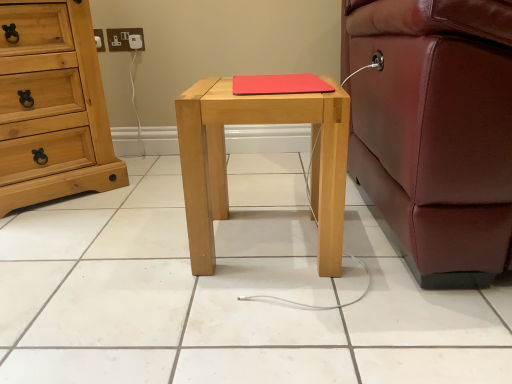
Measure the distance between light brown wooden chest of drawers at left and camera.

3.83 feet.

Find the location of a particular element. This screenshot has width=512, height=384. light brown wooden chest of drawers at left is located at coordinates (53, 108).

You are a GUI agent. You are given a task and a screenshot of the screen. Output one action in this format:
    pyautogui.click(x=<x>, y=<y>)
    Task: Click on the white plastic socket at upper left
    The image size is (512, 384).
    Given the screenshot: What is the action you would take?
    pyautogui.click(x=125, y=39)

Identify the location of light wood/texture nightstand at center. The image size is (512, 384). pos(226,168).

Can you confirm if light wood/texture nightstand at center is thinner than white plastic socket at upper left?

In fact, light wood/texture nightstand at center might be wider than white plastic socket at upper left.

From the image's perspective, is light wood/texture nightstand at center beneath white plastic socket at upper left?

Yes, from the image's perspective, light wood/texture nightstand at center is below white plastic socket at upper left.

Is light wood/texture nightstand at center taller than white plastic socket at upper left?

Indeed, light wood/texture nightstand at center has a greater height compared to white plastic socket at upper left.

Considering the relative sizes of red matte mousepad at center and light wood/texture nightstand at center in the image provided, is red matte mousepad at center taller than light wood/texture nightstand at center?

In fact, red matte mousepad at center may be shorter than light wood/texture nightstand at center.

Is red matte mousepad at center bigger than light wood/texture nightstand at center?

Actually, red matte mousepad at center might be smaller than light wood/texture nightstand at center.

Between red matte mousepad at center and light wood/texture nightstand at center, which one is positioned behind?

Positioned behind is red matte mousepad at center.

Where is `nightstand that appears in front of the red matte mousepad at center`? The image size is (512, 384). nightstand that appears in front of the red matte mousepad at center is located at coordinates (226, 168).

Which of these two, light brown wooden chest of drawers at left or white plastic socket at upper left, is smaller?

white plastic socket at upper left is smaller.

From a real-world perspective, which is physically above, light brown wooden chest of drawers at left or white plastic socket at upper left?

white plastic socket at upper left is physically above.

From the image's perspective, which object appears higher, light brown wooden chest of drawers at left or white plastic socket at upper left?

white plastic socket at upper left is shown above in the image.

Where is `pad below the white plastic socket at upper left (from a real-world perspective)`? Image resolution: width=512 pixels, height=384 pixels. pad below the white plastic socket at upper left (from a real-world perspective) is located at coordinates (279, 84).

Does red matte mousepad at center appear on the left side of white plastic socket at upper left?

No.

Looking at their sizes, would you say red matte mousepad at center is wider or thinner than white plastic socket at upper left?

red matte mousepad at center is wider than white plastic socket at upper left.

Looking at this image, can you confirm if red matte mousepad at center is taller than white plastic socket at upper left?

Incorrect, the height of red matte mousepad at center is not larger of that of white plastic socket at upper left.

Considering the sizes of light wood/texture nightstand at center and light brown wooden chest of drawers at left in the image, is light wood/texture nightstand at center wider or thinner than light brown wooden chest of drawers at left?

light wood/texture nightstand at center is thinner than light brown wooden chest of drawers at left.

Is the depth of light wood/texture nightstand at center greater than that of light brown wooden chest of drawers at left?

No, light wood/texture nightstand at center is closer to the viewer.

Based on their sizes in the image, would you say light wood/texture nightstand at center is bigger or smaller than light brown wooden chest of drawers at left?

light wood/texture nightstand at center is smaller than light brown wooden chest of drawers at left.

Does light wood/texture nightstand at center appear on the left side of light brown wooden chest of drawers at left?

In fact, light wood/texture nightstand at center is to the right of light brown wooden chest of drawers at left.

Between point (337, 234) and point (287, 74), which one is positioned in front?

The point (337, 234) is closer.

Is light wood/texture nightstand at center wider than red matte mousepad at center?

Yes.

Between light wood/texture nightstand at center and red matte mousepad at center, which one appears on the right side from the viewer's perspective?

red matte mousepad at center.

Who is bigger, light wood/texture nightstand at center or red matte mousepad at center?

With larger size is light wood/texture nightstand at center.

Consider the image. Is white plastic socket at upper left situated inside red matte mousepad at center or outside?

white plastic socket at upper left is spatially situated outside red matte mousepad at center.

The width and height of the screenshot is (512, 384). I want to click on electric outlet on the left of red matte mousepad at center, so click(x=125, y=39).

From a real-world perspective, is white plastic socket at upper left physically located above or below red matte mousepad at center?

In terms of real-world spatial position, white plastic socket at upper left is above red matte mousepad at center.

Is white plastic socket at upper left to the left of red matte mousepad at center from the viewer's perspective?

Yes.

This screenshot has height=384, width=512. Identify the location of nightstand that appears below the white plastic socket at upper left (from the image's perspective). (226, 168).

The width and height of the screenshot is (512, 384). What are the coordinates of `nightstand that is on the left side of red matte mousepad at center` in the screenshot? It's located at (226, 168).

Considering their positions, is light wood/texture nightstand at center positioned closer to red matte mousepad at center than white plastic socket at upper left?

Among the two, light wood/texture nightstand at center is located nearer to red matte mousepad at center.

From the image, which object appears to be nearer to light wood/texture nightstand at center, light brown wooden chest of drawers at left or red matte mousepad at center?

Among the two, red matte mousepad at center is located nearer to light wood/texture nightstand at center.

Considering their positions, is white plastic socket at upper left positioned further to red matte mousepad at center than light wood/texture nightstand at center?

white plastic socket at upper left lies further to red matte mousepad at center than the other object.

Which object lies nearer to the anchor point light brown wooden chest of drawers at left, light wood/texture nightstand at center or white plastic socket at upper left?

white plastic socket at upper left lies closer to light brown wooden chest of drawers at left than the other object.

When comparing their distances from white plastic socket at upper left, does red matte mousepad at center or light wood/texture nightstand at center seem further?

The object further to white plastic socket at upper left is light wood/texture nightstand at center.

Looking at the image, which one is located closer to red matte mousepad at center, light wood/texture nightstand at center or light brown wooden chest of drawers at left?

The object closer to red matte mousepad at center is light wood/texture nightstand at center.

When comparing their distances from white plastic socket at upper left, does light brown wooden chest of drawers at left or red matte mousepad at center seem closer?

Among the two, light brown wooden chest of drawers at left is located nearer to white plastic socket at upper left.

Considering their positions, is light brown wooden chest of drawers at left positioned closer to red matte mousepad at center than white plastic socket at upper left?

light brown wooden chest of drawers at left.

The image size is (512, 384). I want to click on nightstand between light brown wooden chest of drawers at left and red matte mousepad at center, so click(x=226, y=168).

This screenshot has height=384, width=512. Identify the location of the chest of drawers located between light wood/texture nightstand at center and white plastic socket at upper left in the depth direction. (53, 108).

Where is `pad between light wood/texture nightstand at center and white plastic socket at upper left along the z-axis`? The width and height of the screenshot is (512, 384). pad between light wood/texture nightstand at center and white plastic socket at upper left along the z-axis is located at coordinates (279, 84).

Where is `chest of drawers between red matte mousepad at center and white plastic socket at upper left from front to back`? chest of drawers between red matte mousepad at center and white plastic socket at upper left from front to back is located at coordinates (53, 108).